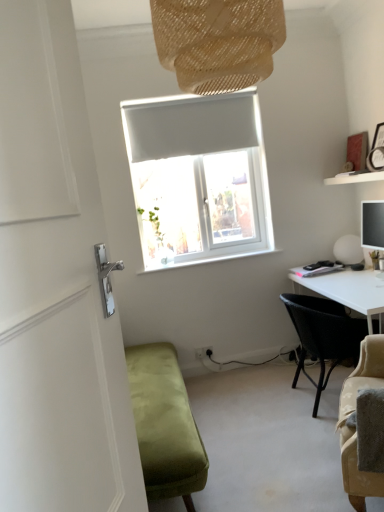
Where is `velvet green bench at lower left`? velvet green bench at lower left is located at coordinates (165, 424).

Describe the element at coordinates (323, 335) in the screenshot. I see `black woven chair at right` at that location.

What do you see at coordinates (55, 285) in the screenshot?
I see `white glossy door handle at left` at bounding box center [55, 285].

The height and width of the screenshot is (512, 384). Find the location of `white matte sphere at right`. white matte sphere at right is located at coordinates click(348, 249).

You are a GUI agent. You are given a task and a screenshot of the screen. Output one action in this format:
    pyautogui.click(x=<x>, y=<y>)
    Task: Click on the velvet green bench at lower left
    This screenshot has width=384, height=512.
    Given the screenshot: What is the action you would take?
    pyautogui.click(x=165, y=424)

Does point (362, 172) appear closer or farther from the camera than point (41, 184)?

Point (362, 172) appears to be farther away from the viewer than point (41, 184).

Find the location of a particular element. shelf behind the white glossy door handle at left is located at coordinates (355, 177).

Is white matte shelf at upper right oriented towards white glossy door handle at left?

No, white matte shelf at upper right is not facing towards white glossy door handle at left.

Is white matte sphere at right looking in the opposite direction of brown woven lampshade at upper center?

No, brown woven lampshade at upper center is not at the back of white matte sphere at right.

Considering the relative sizes of white matte sphere at right and brown woven lampshade at upper center in the image provided, is white matte sphere at right taller than brown woven lampshade at upper center?

No.

Are white matte sphere at right and brown woven lampshade at upper center far apart?

Absolutely, white matte sphere at right is distant from brown woven lampshade at upper center.

Does white matte sphere at right lie behind brown woven lampshade at upper center?

Yes.

Which is in front, white matte sphere at right or white matte shelf at upper right?

white matte shelf at upper right is more forward.

Consider the image. Does white matte sphere at right have a lesser height compared to white matte shelf at upper right?

In fact, white matte sphere at right may be taller than white matte shelf at upper right.

Would you consider white matte sphere at right to be distant from white matte shelf at upper right?

No.

From the image's perspective, between white matte sphere at right and white matte shelf at upper right, which one is located above?

white matte shelf at upper right appears higher in the image.

Is black woven chair at right bigger or smaller than white matte sphere at right?

In the image, black woven chair at right appears to be larger than white matte sphere at right.

Is black woven chair at right far away from white matte sphere at right?

No, there isn't a large distance between black woven chair at right and white matte sphere at right.

Which object is further away from the camera, black woven chair at right or white matte sphere at right?

white matte sphere at right is behind.

From the image's perspective, is velvet green bench at lower left above or below white matte shelf at upper right?

Based on their image positions, velvet green bench at lower left is located beneath white matte shelf at upper right.

Could you tell me if velvet green bench at lower left is facing white matte shelf at upper right?

No, velvet green bench at lower left does not turn towards white matte shelf at upper right.

Are velvet green bench at lower left and white matte shelf at upper right beside each other?

No, velvet green bench at lower left is not touching white matte shelf at upper right.

Is point (183, 488) closer to camera compared to point (380, 173)?

Yes, it is in front of point (380, 173).

From a real-world perspective, relative to white matte sphere at right, is brown woven lampshade at upper center vertically above or below?

brown woven lampshade at upper center is above white matte sphere at right.

Is brown woven lampshade at upper center bigger than white matte sphere at right?

Yes.

Is white matte sphere at right located within brown woven lampshade at upper center?

No, white matte sphere at right is not surrounded by brown woven lampshade at upper center.

Can you confirm if brown woven lampshade at upper center is thinner than white matte sphere at right?

Incorrect, the width of brown woven lampshade at upper center is not less than that of white matte sphere at right.

Which object is further away from the camera, brown woven lampshade at upper center or white glossy door handle at left?

brown woven lampshade at upper center is further away from the camera.

Which of these two, brown woven lampshade at upper center or white glossy door handle at left, is thinner?

With smaller width is white glossy door handle at left.

Can you tell me how much brown woven lampshade at upper center and white glossy door handle at left differ in facing direction?

They differ by 72.4 degrees in their facing directions.

Where is `lamp behind the white glossy door handle at left`? The width and height of the screenshot is (384, 512). lamp behind the white glossy door handle at left is located at coordinates (218, 41).

Where is `shelf behind the white glossy door handle at left`? This screenshot has height=512, width=384. shelf behind the white glossy door handle at left is located at coordinates (355, 177).

Find the location of a particular element. The image size is (384, 512). table lamp below the brown woven lampshade at upper center (from the image's perspective) is located at coordinates (348, 249).

When comparing their distances from white matte shelf at upper right, does white glossy door handle at left or black woven chair at right seem further?

Based on the image, white glossy door handle at left appears to be further to white matte shelf at upper right.

From the image, which object appears to be nearer to white glossy door handle at left, white matte sphere at right or brown woven lampshade at upper center?

Based on the image, brown woven lampshade at upper center appears to be nearer to white glossy door handle at left.

Based on their spatial positions, is black woven chair at right or brown woven lampshade at upper center further from white matte shelf at upper right?

brown woven lampshade at upper center lies further to white matte shelf at upper right than the other object.

Based on their spatial positions, is white matte shelf at upper right or white glossy door handle at left closer to brown woven lampshade at upper center?

white glossy door handle at left is closer to brown woven lampshade at upper center.

Looking at the image, which one is located further to white matte shelf at upper right, brown woven lampshade at upper center or white glossy door handle at left?

Based on the image, white glossy door handle at left appears to be further to white matte shelf at upper right.

Looking at the image, which one is located closer to white matte shelf at upper right, white matte sphere at right or brown woven lampshade at upper center?

The object closer to white matte shelf at upper right is white matte sphere at right.

Looking at the image, which one is located closer to brown woven lampshade at upper center, velvet green bench at lower left or black woven chair at right?

velvet green bench at lower left is positioned closer to the anchor brown woven lampshade at upper center.

When comparing their distances from black woven chair at right, does white matte sphere at right or white glossy door handle at left seem closer?

Among the two, white matte sphere at right is located nearer to black woven chair at right.

Image resolution: width=384 pixels, height=512 pixels. I want to click on shelf between brown woven lampshade at upper center and velvet green bench at lower left vertically, so click(x=355, y=177).

Locate an element on the screen. The height and width of the screenshot is (512, 384). chair that lies between brown woven lampshade at upper center and velvet green bench at lower left from top to bottom is located at coordinates (323, 335).

Image resolution: width=384 pixels, height=512 pixels. Identify the location of lamp between white glossy door handle at left and white matte shelf at upper right in the front-back direction. (218, 41).

The image size is (384, 512). I want to click on shelf located between white glossy door handle at left and white matte sphere at right in the depth direction, so click(355, 177).